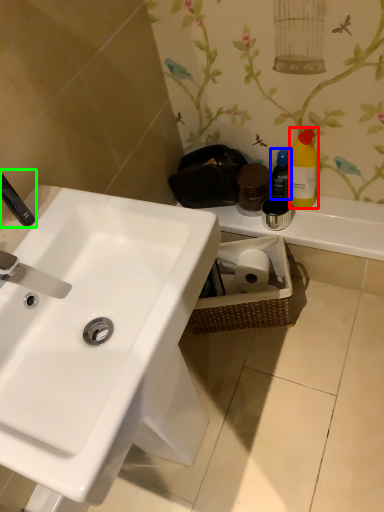
Question: Based on their relative distances, which object is nearer to cleaning product (highlighted by a red box)? Choose from toiletry (highlighted by a blue box) and plumbing fixture (highlighted by a green box).

Choices:
 (A) toiletry
 (B) plumbing fixture

Answer: (A)